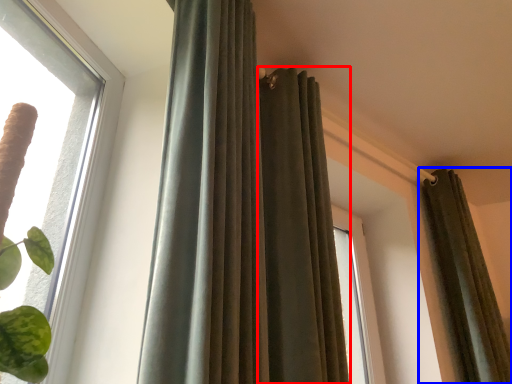
Question: Among these objects, which one is nearest to the camera, curtain (highlighted by a red box) or curtain (highlighted by a blue box)?

Choices:
 (A) curtain
 (B) curtain

Answer: (A)